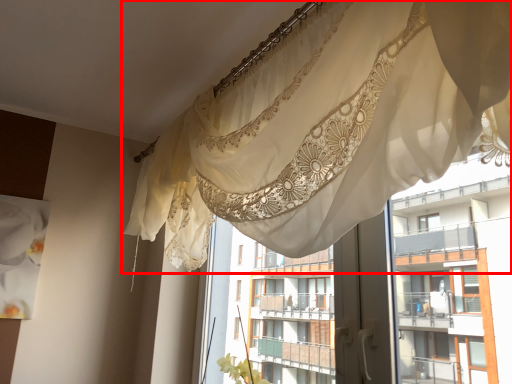
Question: From the image's perspective, where is curtain (annotated by the red box) located relative to residence?

Choices:
 (A) below
 (B) above

Answer: (B)